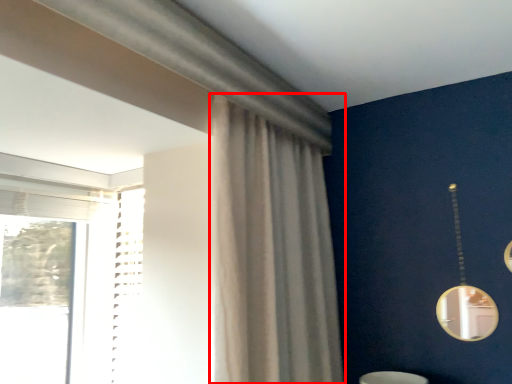
Question: From the image's perspective, what is the correct spatial positioning of curtain (annotated by the red box) in reference to mirror?

Choices:
 (A) below
 (B) above

Answer: (B)